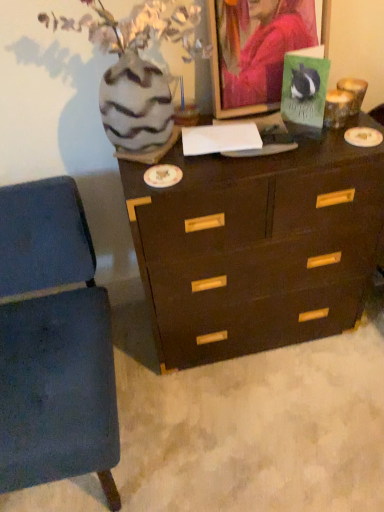
The width and height of the screenshot is (384, 512). Identify the location of vacant space in between dark wood chest of drawers at center and blue fabric chair at lower left. (217, 394).